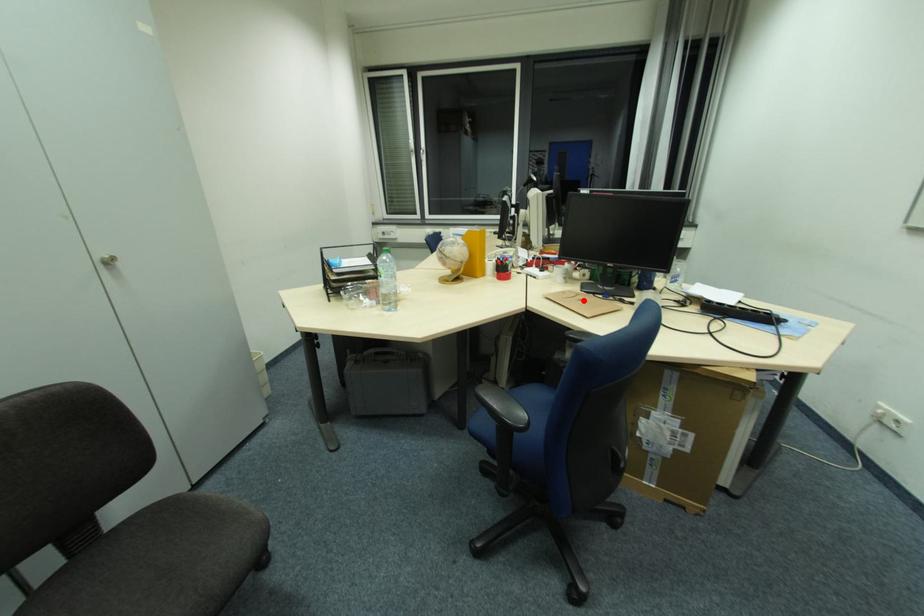
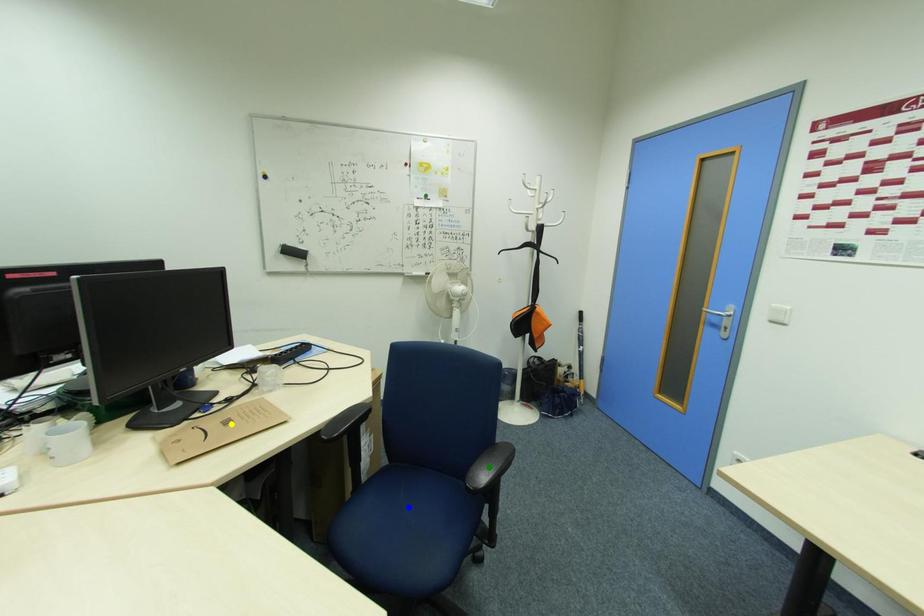
Question: I am providing you with two images of the same scene from different viewpoints. A red point is marked on the first image. You are given multiple points on the second image. In image 2, which mark is for the same physical point as the one in image 1?

Choices:
 (A) green point
 (B) blue point
 (C) yellow point

Answer: (C)